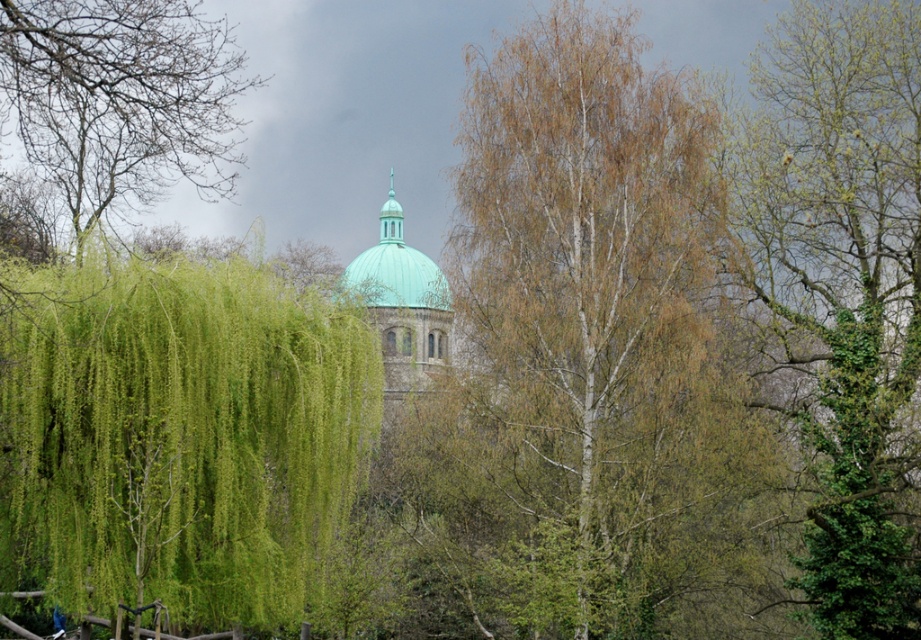
From the picture: You are standing in the outdoor area and want to take a photo of the green leafy tree at right and the green matte dome at center. Which object should you focus on first to ensure both are in the frame without moving the camera?

You should focus on the green leafy tree at right first because it is closer to the viewer than the green matte dome at center, so adjusting the focus to the closer object will help keep both in the frame.

You are standing at the point marked as point (581, 362) in the image. What can you see directly in front of you?

At point (581, 362), you can see the smooth white bark tree at center directly in front of you.

You are a bird flying over the scene and want to land on the highest point between the green leafy tree at right and the green matte dome at center. Which one should you choose?

The green matte dome at center is higher than the green leafy tree at right, so you should land on the green matte dome at center.